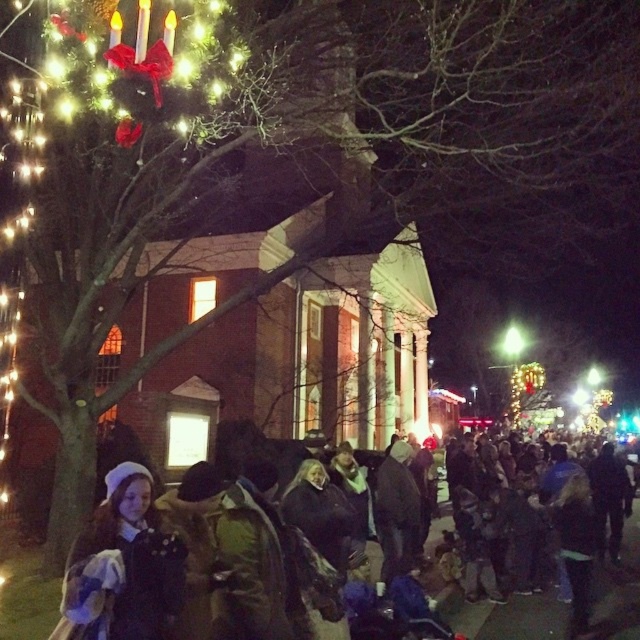
Who is more distant from viewer, (147, 468) or (205, 508)?

Positioned behind is point (147, 468).

Who is more forward, (168,548) or (637,605)?

Positioned in front is point (168,548).

Identify the location of velvet blue coat at lower left. The height and width of the screenshot is (640, 640). (122, 566).